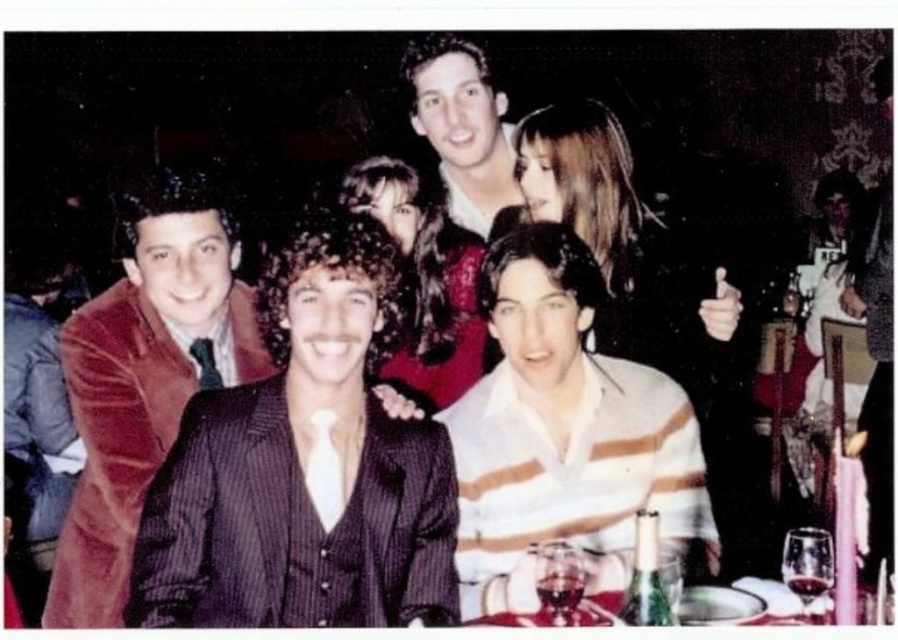
Can you confirm if smooth brown hair at upper center is shorter than shiny silver tray at lower center?

No, smooth brown hair at upper center is not shorter than shiny silver tray at lower center.

Is smooth brown hair at upper center taller than shiny silver tray at lower center?

Indeed, smooth brown hair at upper center has a greater height compared to shiny silver tray at lower center.

The height and width of the screenshot is (640, 898). What do you see at coordinates (624, 248) in the screenshot? I see `smooth brown hair at upper center` at bounding box center [624, 248].

Image resolution: width=898 pixels, height=640 pixels. What are the coordinates of `smooth brown hair at upper center` in the screenshot? It's located at (624, 248).

Measure the distance between smooth brown hair at upper center and camera.

smooth brown hair at upper center and camera are 1.95 meters apart from each other.

Between smooth brown hair at upper center and shiny dark hair at center, which one appears on the left side from the viewer's perspective?

Positioned to the left is shiny dark hair at center.

Describe the element at coordinates (624, 248) in the screenshot. I see `smooth brown hair at upper center` at that location.

In order to click on smooth brown hair at upper center in this screenshot , I will do `click(624, 248)`.

Does white striped sweater at center come behind shiny dark hair at center?

No, white striped sweater at center is closer to the viewer.

Between white striped sweater at center and shiny dark hair at center, which one has more height?

Standing taller between the two is white striped sweater at center.

Is point (524, 289) closer to viewer compared to point (409, 196)?

Yes, point (524, 289) is closer to viewer.

At what (x,y) coordinates should I click in order to perform the action: click on white striped sweater at center. Please return your answer as a coordinate pair (x, y). The height and width of the screenshot is (640, 898). Looking at the image, I should click on (562, 435).